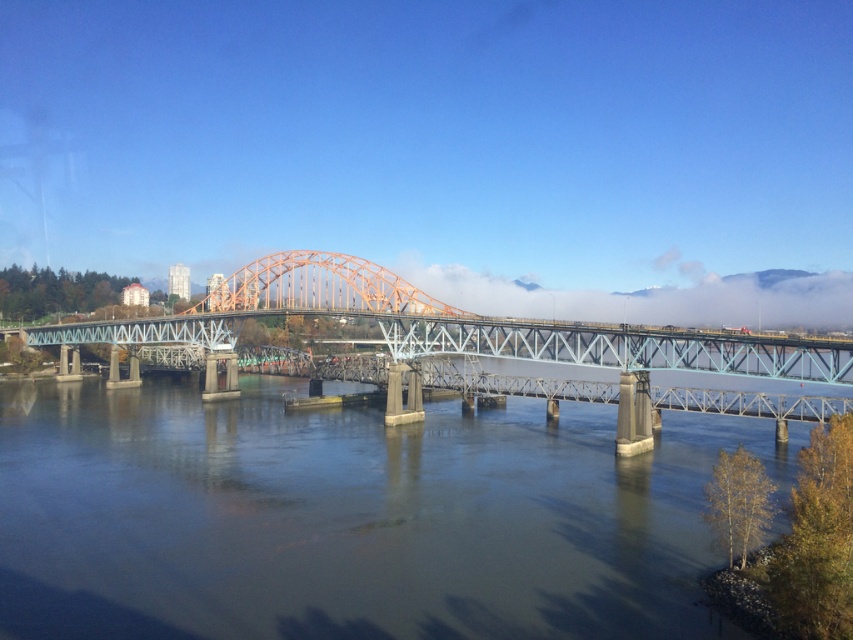
You are a boat captain navigating a narrow waterway. You see the smooth concrete river at center and the orange metallic bridge at center. Which one has a narrower width?

The smooth concrete river at center is thinner than the orange metallic bridge at center, so the smooth concrete river at center has a narrower width.

You are a photographer planning to capture the entire orange metallic bridge at center and the smooth concrete river at center in a single shot. Based on the scene, which object will appear smaller in the photo?

The smooth concrete river at center will appear smaller in the photo because it occupies less space than the orange metallic bridge at center.